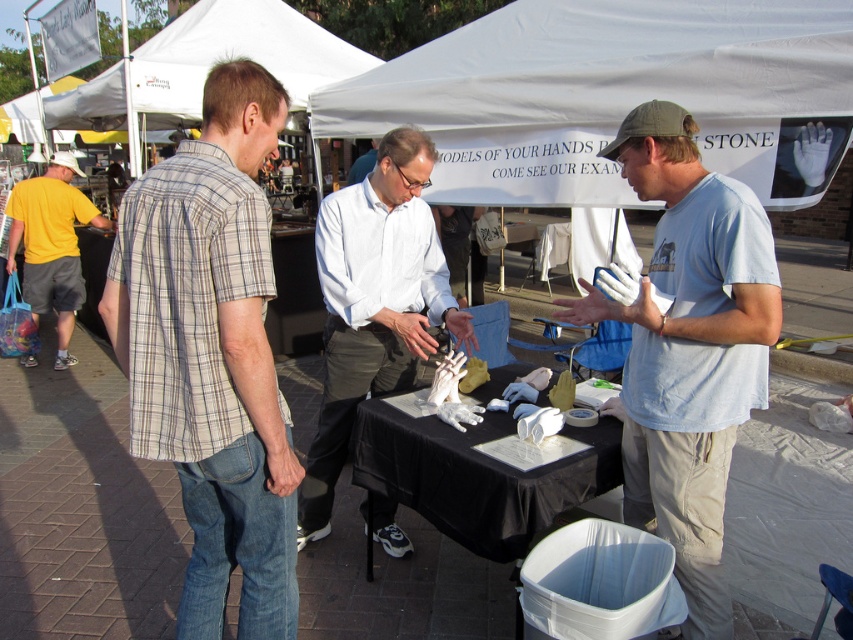
Question: Does plaid shirt at center have a smaller size compared to light blue t-shirt at center?

Choices:
 (A) no
 (B) yes

Answer: (B)

Question: Is the position of white matte hand at center more distant than that of yellow cotton shirt at left?

Choices:
 (A) no
 (B) yes

Answer: (A)

Question: Which point is closer to the camera?

Choices:
 (A) yellow cotton shirt at left
 (B) plaid shirt at center
 (C) black matte table at center
 (D) light blue t-shirt at center

Answer: (B)

Question: Which point is closer to the camera taking this photo?

Choices:
 (A) (248, 74)
 (B) (521, 484)
 (C) (637, 360)
 (D) (381, 369)

Answer: (A)

Question: Does light blue t-shirt at center appear under black matte table at center?

Choices:
 (A) no
 (B) yes

Answer: (A)

Question: Which point is farther from the camera taking this photo?

Choices:
 (A) (709, 209)
 (B) (556, 488)
 (C) (422, 340)
 (D) (36, 211)

Answer: (D)